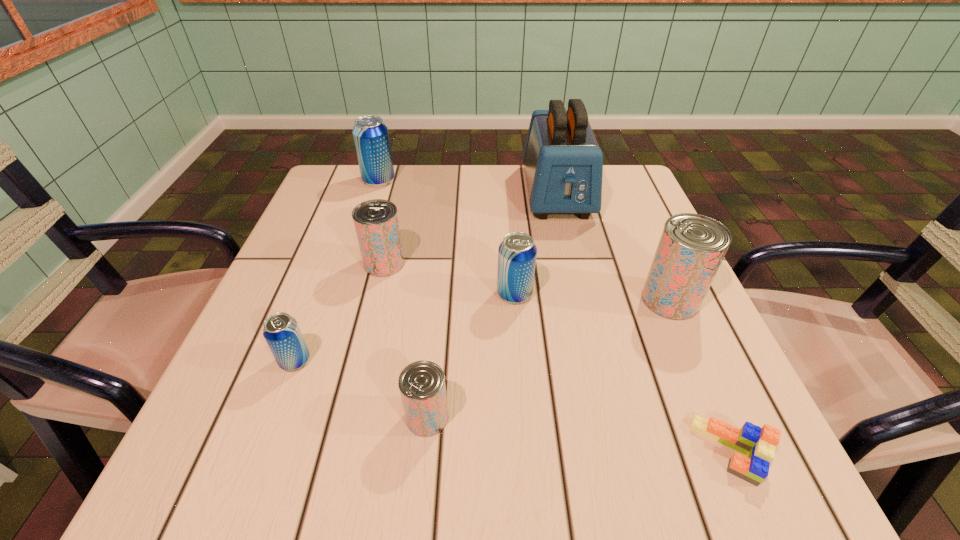
Image resolution: width=960 pixels, height=540 pixels. Identify the location of Lego that is at the right edge. (758, 444).

Locate an element on the screen. Image resolution: width=960 pixels, height=540 pixels. object situated at the far left corner is located at coordinates (371, 137).

You are a GUI agent. You are given a task and a screenshot of the screen. Output one action in this format:
    pyautogui.click(x=<x>, y=<y>)
    Task: Click on the object at the far right corner
    The image size is (960, 540).
    Given the screenshot: What is the action you would take?
    pyautogui.click(x=563, y=162)

This screenshot has height=540, width=960. I want to click on object that is at the near right corner, so (x=758, y=444).

You are a GUI agent. You are given a task and a screenshot of the screen. Output one action in this format:
    pyautogui.click(x=<x>, y=<y>)
    Task: Click on the vacant space at the far edge of the desktop
    This screenshot has height=540, width=960.
    Given the screenshot: What is the action you would take?
    pyautogui.click(x=391, y=198)

At what (x,y) coordinates should I click in order to perform the action: click on vacant space at the near edge of the desktop. Please return your answer as a coordinate pair (x, y). Looking at the image, I should click on (481, 450).

You are a GUI agent. You are given a task and a screenshot of the screen. Output one action in this format:
    pyautogui.click(x=<x>, y=<y>)
    Task: Click on the vacant space at the left edge of the desktop
    
    Given the screenshot: What is the action you would take?
    pyautogui.click(x=267, y=370)

Identify the location of vacant space at the right edge of the desktop. (649, 220).

In the image, there is a desktop. At what (x,y) coordinates should I click in order to perform the action: click on free space at the far left corner. Please return your answer as a coordinate pair (x, y). This screenshot has height=540, width=960. Looking at the image, I should click on (352, 177).

Identify the location of free space at the far right corner of the desktop. The image size is (960, 540). (629, 170).